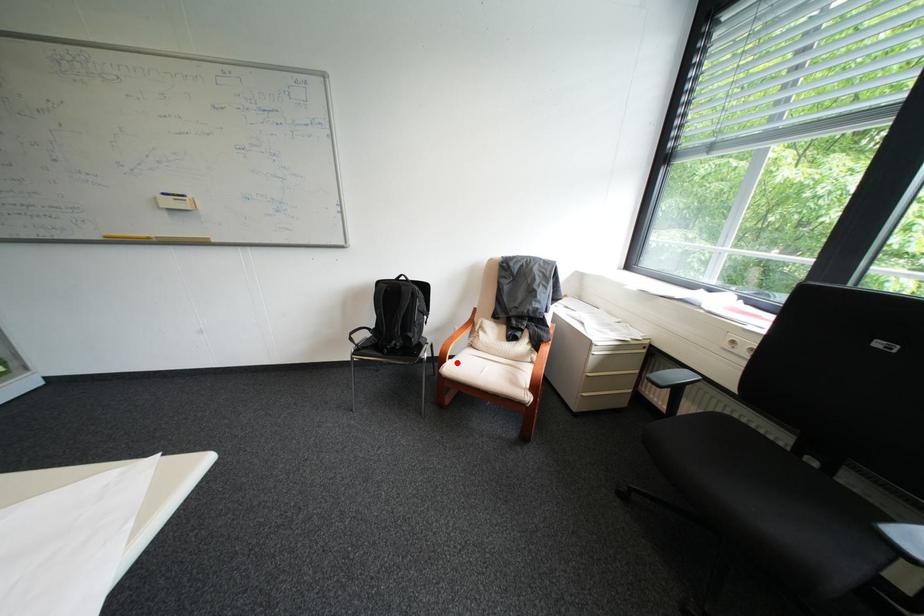
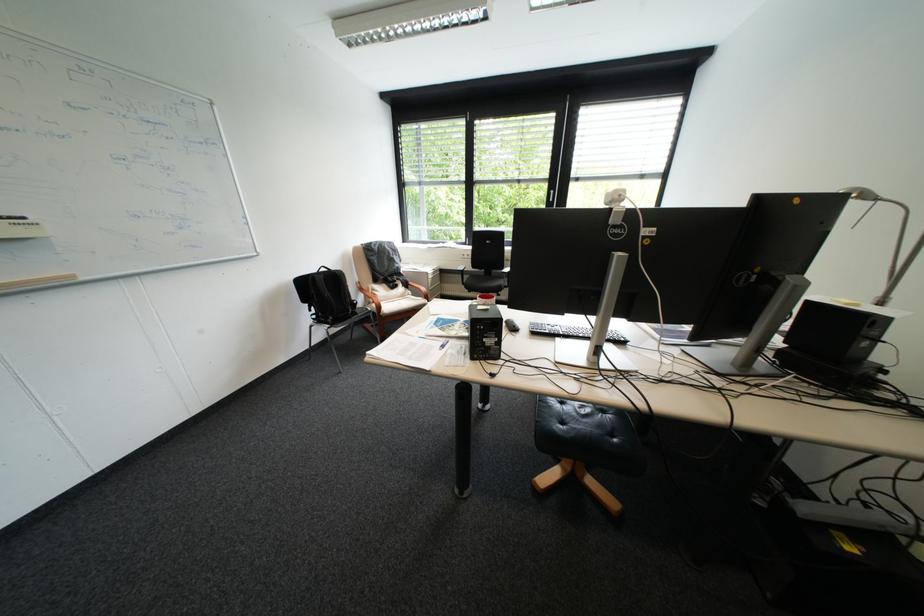
Where in the second image is the point corresponding to the highlighted location from the first image?

(394, 309)